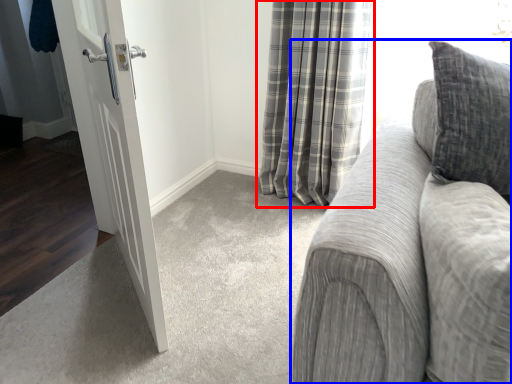
Question: Which object is closer to the camera taking this photo, curtain (highlighted by a red box) or studio couch (highlighted by a blue box)?

Choices:
 (A) curtain
 (B) studio couch

Answer: (B)